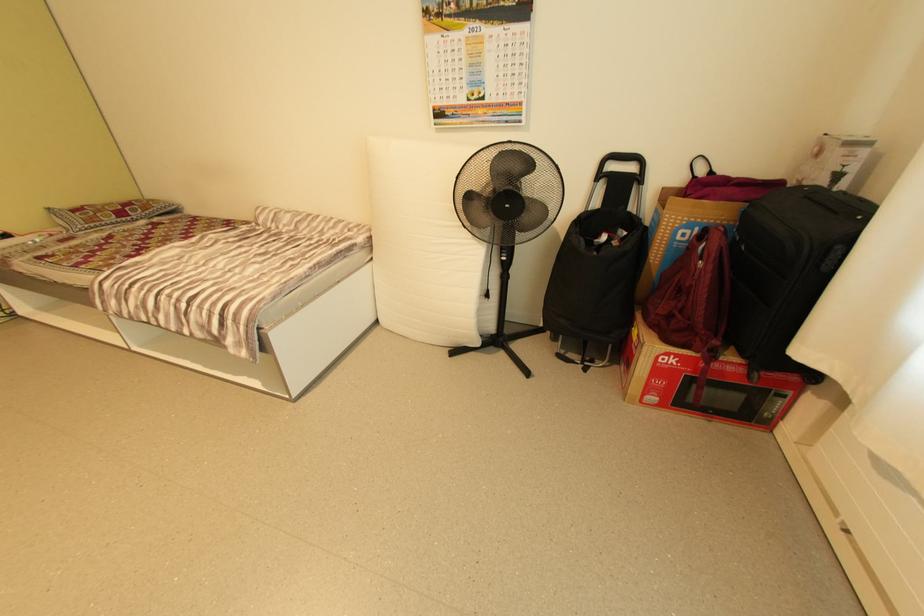
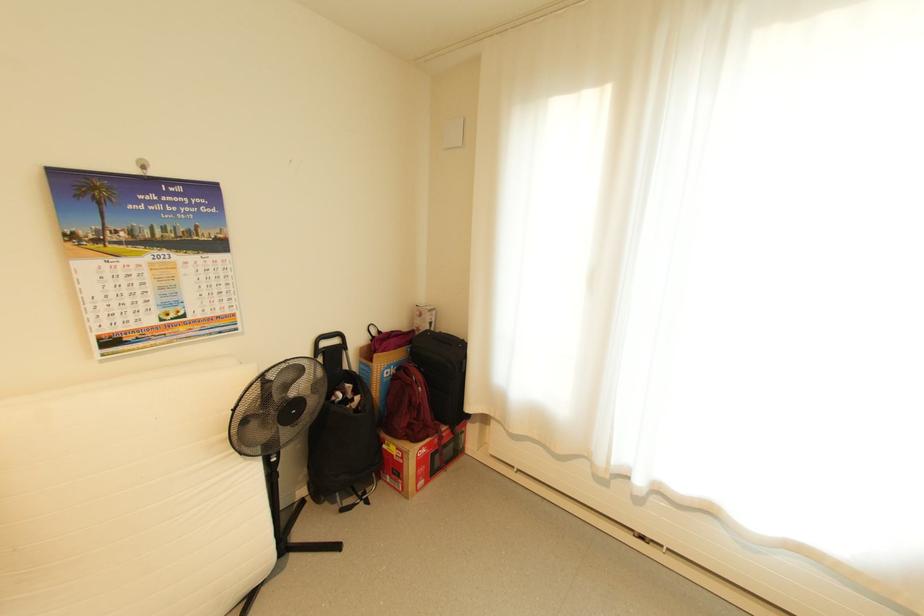
Question: The images are taken continuously from a first-person perspective. In which direction is your viewpoint rotating?

Choices:
 (A) Left
 (B) Right
 (C) Up
 (D) Down

Answer: (B)